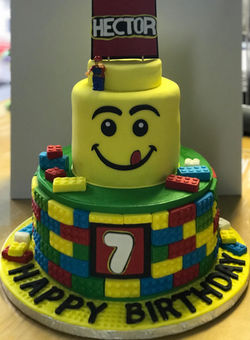
Where is `toys`? This screenshot has width=250, height=340. toys is located at coordinates (90, 150).